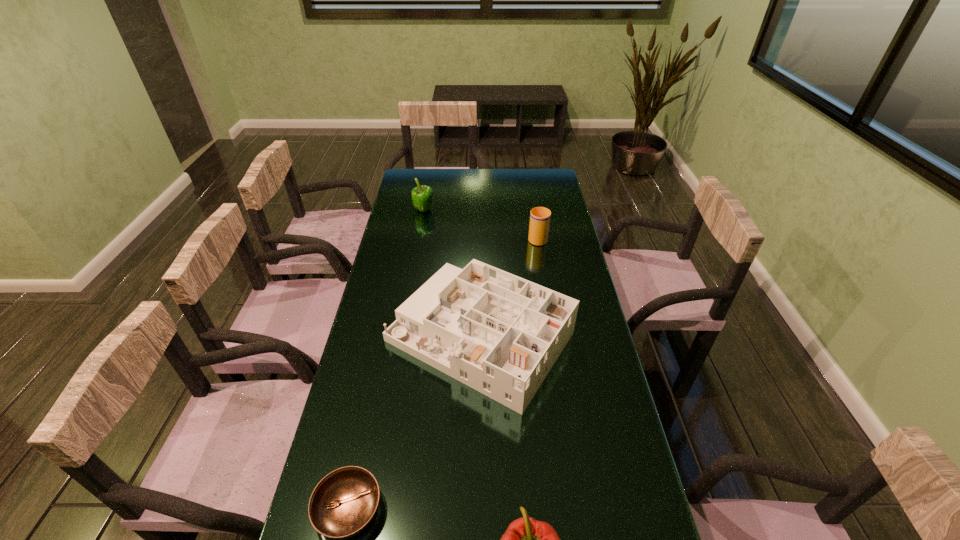
What are the coordinates of `the taller bell pepper` in the screenshot? It's located at (422, 195).

The image size is (960, 540). What are the coordinates of `the farther bell pepper` in the screenshot? It's located at (422, 195).

Where is `the third farthest object`? The width and height of the screenshot is (960, 540). the third farthest object is located at coordinates (500, 334).

You are a GUI agent. You are given a task and a screenshot of the screen. Output one action in this format:
    pyautogui.click(x=<x>, y=<y>)
    Task: Click on the second farthest object
    
    Given the screenshot: What is the action you would take?
    pyautogui.click(x=540, y=217)

Locate an element on the screen. vacant area located on the right of the farther bell pepper is located at coordinates (511, 211).

At what (x,y) coordinates should I click in order to perform the action: click on vacant space located 0.300m on the back of the third farthest object. Please return your answer as a coordinate pair (x, y). The height and width of the screenshot is (540, 960). Looking at the image, I should click on (480, 232).

You are a GUI agent. You are given a task and a screenshot of the screen. Output one action in this format:
    pyautogui.click(x=<x>, y=<y>)
    Task: Click on the blank space located 0.380m on the side of the second farthest object with the handle
    Image resolution: width=960 pixels, height=540 pixels.
    Given the screenshot: What is the action you would take?
    pyautogui.click(x=529, y=185)

Find the location of a particular element. This screenshot has height=540, width=960. vacant space located on the side of the second farthest object with the handle is located at coordinates (535, 219).

Find the location of a particular element. Image resolution: width=960 pixels, height=540 pixels. free space located 0.110m on the side of the second farthest object with the handle is located at coordinates (534, 215).

Where is `bell pepper at the left edge`? The image size is (960, 540). bell pepper at the left edge is located at coordinates (422, 195).